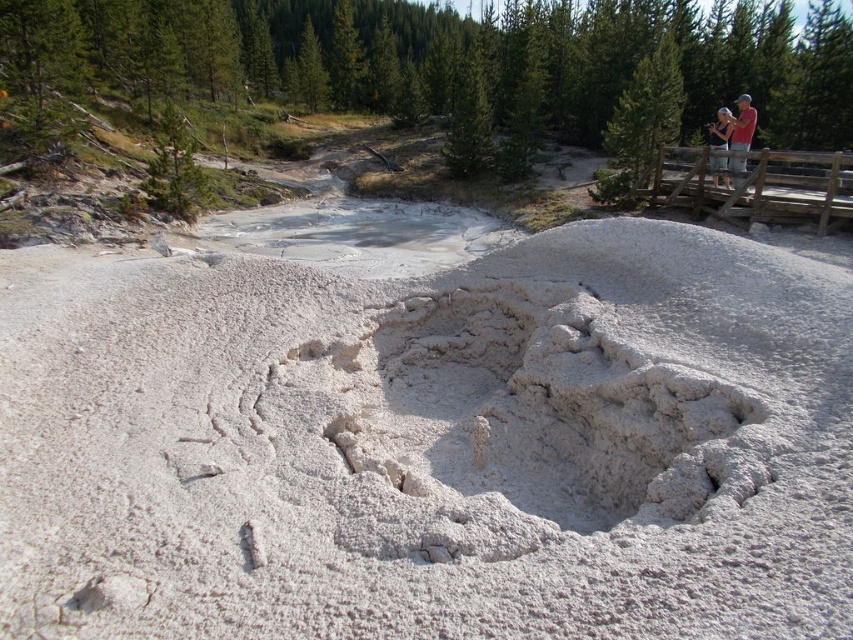
Question: Can you confirm if red shirt at upper right is positioned to the right of light blue denim shirt at upper right?

Choices:
 (A) no
 (B) yes

Answer: (B)

Question: Can you confirm if white powdery mound at center is positioned below light blue denim shirt at upper right?

Choices:
 (A) yes
 (B) no

Answer: (A)

Question: From the image, what is the correct spatial relationship of white powdery mound at center in relation to red shirt at upper right?

Choices:
 (A) right
 (B) left

Answer: (B)

Question: Which point is closer to the camera?

Choices:
 (A) light blue denim shirt at upper right
 (B) red shirt at upper right
 (C) white powdery mound at center

Answer: (C)

Question: Which point is farther from the camera taking this photo?

Choices:
 (A) (715, 148)
 (B) (740, 140)
 (C) (755, 483)

Answer: (B)

Question: Which point is closer to the camera taking this photo?

Choices:
 (A) (744, 122)
 (B) (726, 188)

Answer: (A)